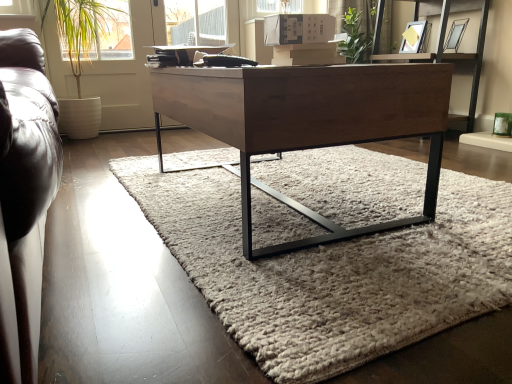
Find the location of `wooden shelf at upper center`. wooden shelf at upper center is located at coordinates (442, 54).

What are the coordinates of `wooden desk at center` in the screenshot? It's located at (309, 122).

In order to face wooden desk at center, should I rotate leftwards or rightwards?

A 1.721 degree turn to the right will do.

Where is `soft gray wool rug at center`? soft gray wool rug at center is located at coordinates (332, 271).

The width and height of the screenshot is (512, 384). In order to click on wooden shelf at upper center in this screenshot , I will do `click(442, 54)`.

Based on the photo, which of these two, green leafy plant at left or wooden shelf at upper center, is thinner?

green leafy plant at left is thinner.

How far apart are green leafy plant at left and wooden shelf at upper center?

1.99 meters.

Is point (94, 13) less distant than point (451, 115)?

No, it is behind (451, 115).

Consider the image. In terms of height, does green leafy plant at left look taller or shorter compared to wooden shelf at upper center?

In the image, green leafy plant at left appears to be taller than wooden shelf at upper center.

Could you tell me if green leafy plant at left is facing wooden desk at center?

Yes, green leafy plant at left faces towards wooden desk at center.

Which is behind, green leafy plant at left or wooden desk at center?

green leafy plant at left is further from the camera.

Would you say green leafy plant at left is a long distance from wooden desk at center?

Yes, green leafy plant at left is far from wooden desk at center.

From a real-world perspective, which is physically above, wooden shelf at upper center or green leafy plant at left?

green leafy plant at left is physically above.

Is wooden shelf at upper center facing towards green leafy plant at left?

No, wooden shelf at upper center does not turn towards green leafy plant at left.

Which object is further away from the camera taking this photo, wooden shelf at upper center or green leafy plant at left?

green leafy plant at left is more distant.

From the image's perspective, is wooden shelf at upper center below green leafy plant at left?

Yes.

Is soft gray wool rug at center shorter than wooden shelf at upper center?

Yes.

Is soft gray wool rug at center positioned with its back to wooden shelf at upper center?

No, soft gray wool rug at center is not facing the opposite direction of wooden shelf at upper center.

From the image's perspective, which is below, soft gray wool rug at center or wooden shelf at upper center?

soft gray wool rug at center appears lower in the image.

Who is bigger, soft gray wool rug at center or wooden shelf at upper center?

wooden shelf at upper center is bigger.

Is wooden shelf at upper center oriented away from soft gray wool rug at center?

wooden shelf at upper center is not turned away from soft gray wool rug at center.

Is wooden shelf at upper center beside soft gray wool rug at center?

wooden shelf at upper center and soft gray wool rug at center are not in contact.

Considering the relative sizes of wooden shelf at upper center and soft gray wool rug at center in the image provided, is wooden shelf at upper center taller than soft gray wool rug at center?

Indeed, wooden shelf at upper center has a greater height compared to soft gray wool rug at center.

Is wooden shelf at upper center further to camera compared to soft gray wool rug at center?

Yes, wooden shelf at upper center is further from the viewer.

Does green leafy plant at left turn towards soft gray wool rug at center?

Yes, green leafy plant at left is facing soft gray wool rug at center.

From the picture: Is green leafy plant at left spatially inside soft gray wool rug at center, or outside of it?

green leafy plant at left cannot be found inside soft gray wool rug at center.

From a real-world perspective, which object rests below the other?

soft gray wool rug at center.

In the scene shown: Between green leafy plant at left and soft gray wool rug at center, which one has smaller width?

Thinner between the two is green leafy plant at left.

Is wooden desk at center bigger or smaller than wooden shelf at upper center?

wooden desk at center is bigger than wooden shelf at upper center.

Is wooden desk at center to the left of wooden shelf at upper center from the viewer's perspective?

Yes, wooden desk at center is to the left of wooden shelf at upper center.

Is wooden desk at center wider or thinner than wooden shelf at upper center?

Considering their sizes, wooden desk at center looks broader than wooden shelf at upper center.

Where is `plant that is above the wooden shelf at upper center (from the image's perspective)`? plant that is above the wooden shelf at upper center (from the image's perspective) is located at coordinates (84, 29).

Find the location of a particular element. desk below the green leafy plant at left (from the image's perspective) is located at coordinates pos(309,122).

Based on their spatial positions, is soft gray wool rug at center or wooden desk at center further from green leafy plant at left?

Based on the image, soft gray wool rug at center appears to be further to green leafy plant at left.

From the image, which object appears to be nearer to wooden desk at center, green leafy plant at left or wooden shelf at upper center?

wooden shelf at upper center is positioned closer to the anchor wooden desk at center.

Based on their spatial positions, is wooden shelf at upper center or green leafy plant at left closer to soft gray wool rug at center?

Based on the image, wooden shelf at upper center appears to be nearer to soft gray wool rug at center.

Considering their positions, is wooden shelf at upper center positioned closer to green leafy plant at left than soft gray wool rug at center?

Based on the image, wooden shelf at upper center appears to be nearer to green leafy plant at left.

Based on their spatial positions, is wooden desk at center or green leafy plant at left closer to soft gray wool rug at center?

The object closer to soft gray wool rug at center is wooden desk at center.

When comparing their distances from soft gray wool rug at center, does wooden desk at center or wooden shelf at upper center seem closer?

wooden desk at center is positioned closer to the anchor soft gray wool rug at center.

Estimate the real-world distances between objects in this image. Which object is further from wooden desk at center, soft gray wool rug at center or green leafy plant at left?

green leafy plant at left.

When comparing their distances from wooden shelf at upper center, does green leafy plant at left or soft gray wool rug at center seem further?

Among the two, green leafy plant at left is located further to wooden shelf at upper center.

I want to click on desk positioned between soft gray wool rug at center and wooden shelf at upper center from near to far, so click(309, 122).

I want to click on desk between soft gray wool rug at center and green leafy plant at left along the z-axis, so click(x=309, y=122).

Identify the location of shelf between soft gray wool rug at center and green leafy plant at left along the z-axis. (442, 54).

Image resolution: width=512 pixels, height=384 pixels. Identify the location of desk located between green leafy plant at left and wooden shelf at upper center in the left-right direction. (309, 122).